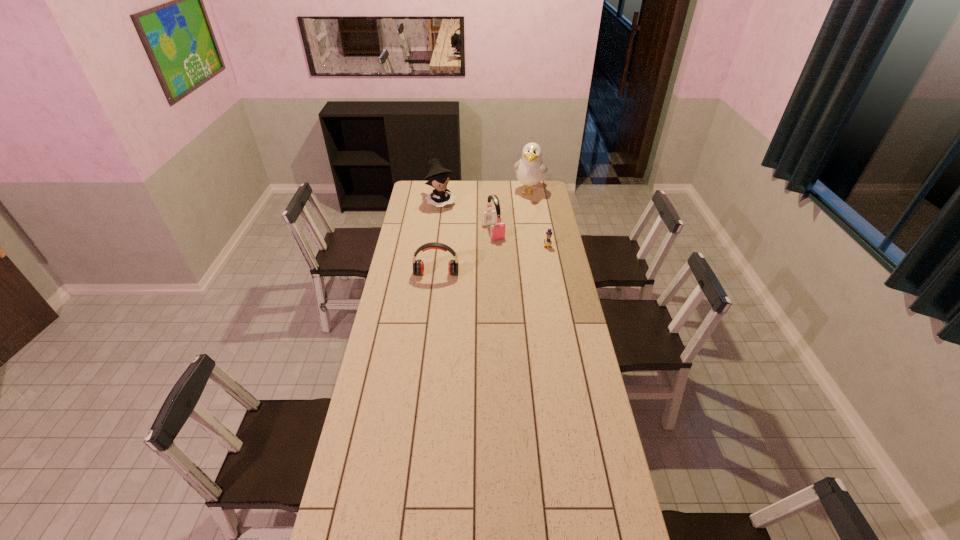
What are the coordinates of `vacant space on the desktop that is between the nearest object and the fourth farthest object and is positioned on the beak of the tallest object` in the screenshot? It's located at (506, 256).

The height and width of the screenshot is (540, 960). Find the location of `vacant spot on the desktop that is between the nearer earphone and the second nearest object and is positioned at the face of the doll`. vacant spot on the desktop that is between the nearer earphone and the second nearest object and is positioned at the face of the doll is located at coordinates (491, 261).

This screenshot has width=960, height=540. In order to click on free space on the desktop that is between the left earphone and the shortest object and is positioned on the outer surface of the right earphone in this screenshot , I will do `click(508, 256)`.